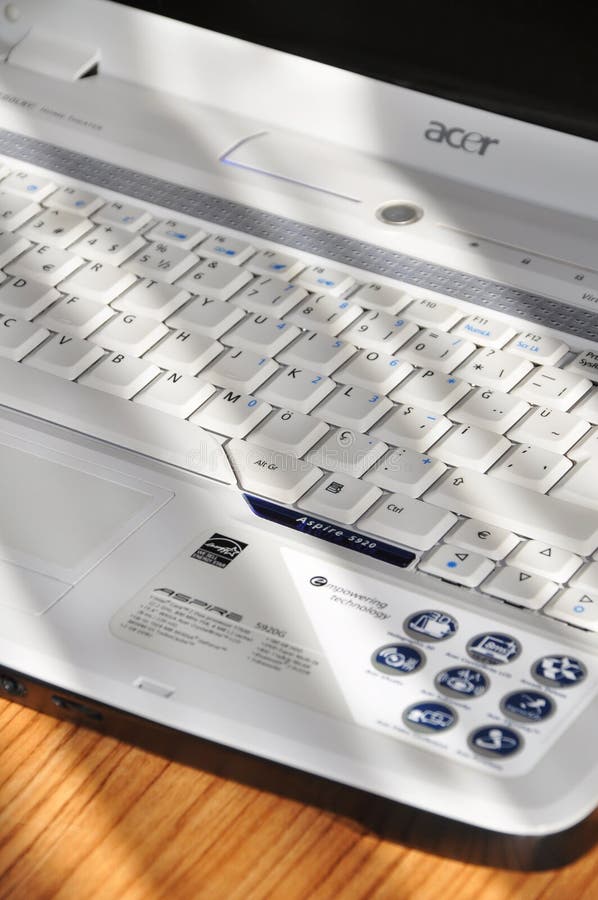
The width and height of the screenshot is (598, 900). I want to click on keyboard, so click(x=344, y=365).